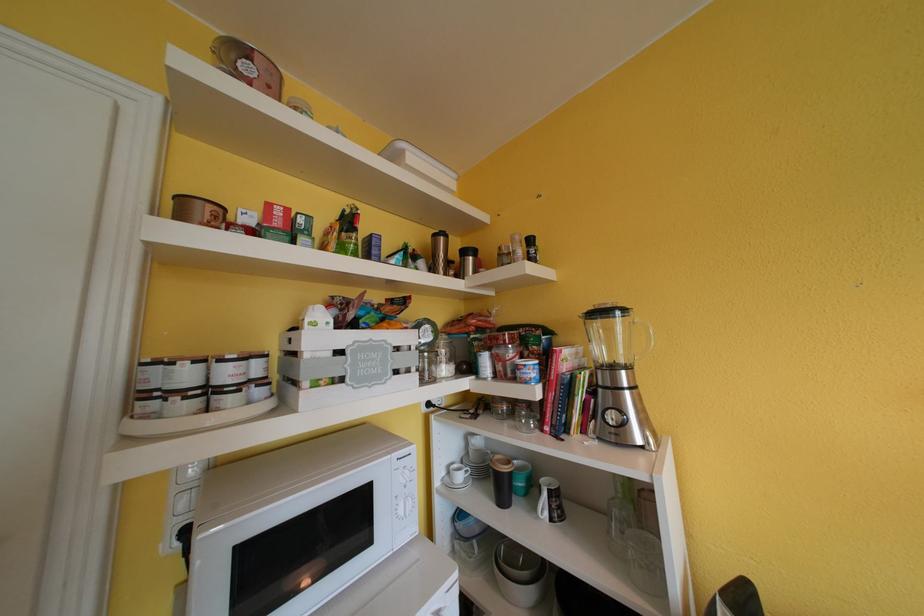
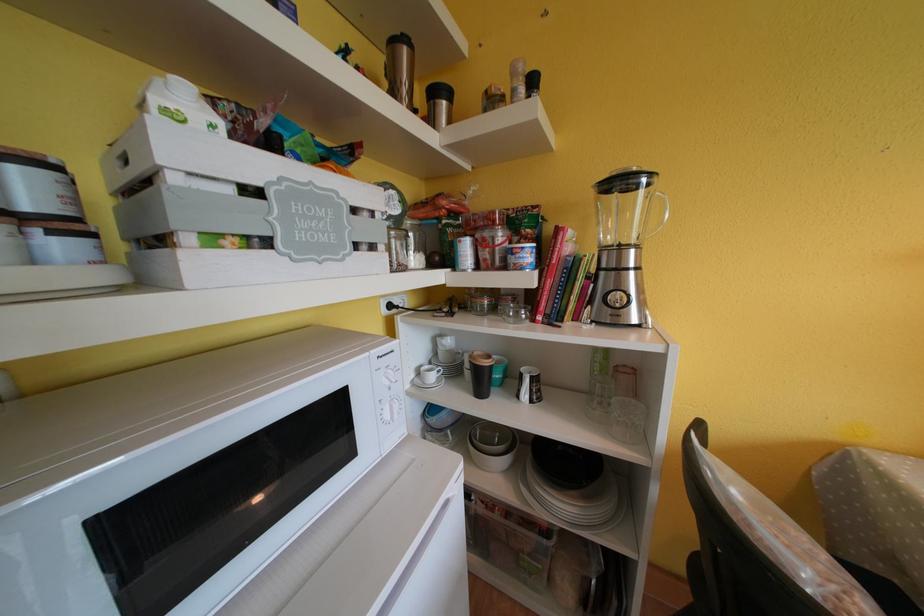
Where in the second image is the point corresponding to (442,238) from the first image?

(399, 46)